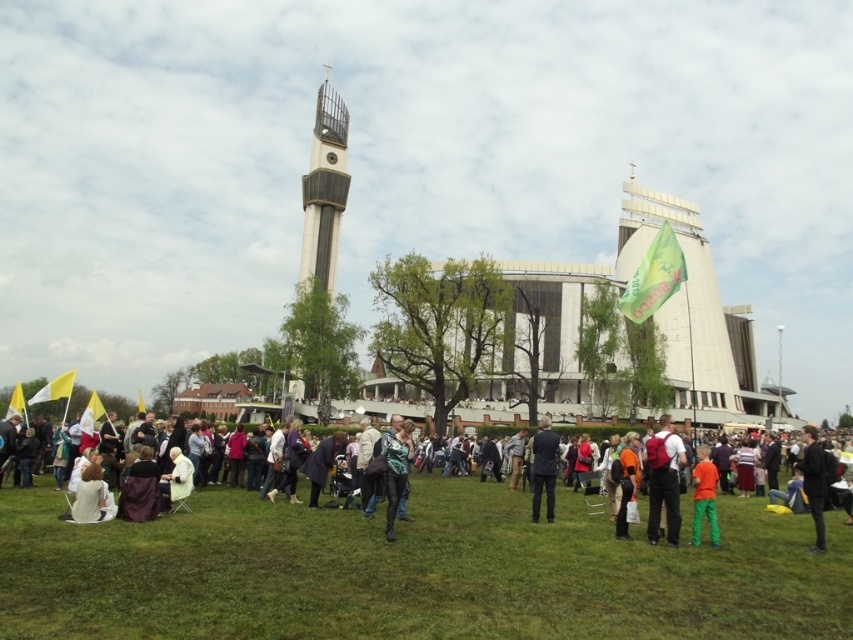
You are standing at the center of the gathering and want to locate the dark blue leather jacket at lower right. According to the coordinates provided, in which direction should you look to find it?

The dark blue leather jacket at lower right is located at coordinates point (813,483), so you should look to your lower right direction to find it.

You are standing at the origin point in the image and want to locate the matte black jacket at center. Which direction should you move to reach it?

The matte black jacket at center is located at point 0.823 on the x axis and 0.383 on the y axis. Since the origin is at the bottom left corner, you should move to the right and slightly up to reach it.